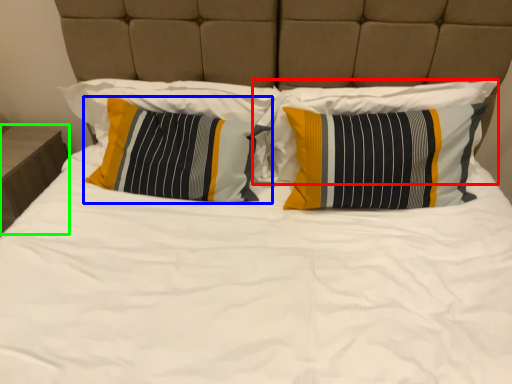
Question: Based on their relative distances, which object is nearer to pillow (highlighted by a red box)? Choose from pillow (highlighted by a blue box) and nightstand (highlighted by a green box).

Choices:
 (A) pillow
 (B) nightstand

Answer: (A)